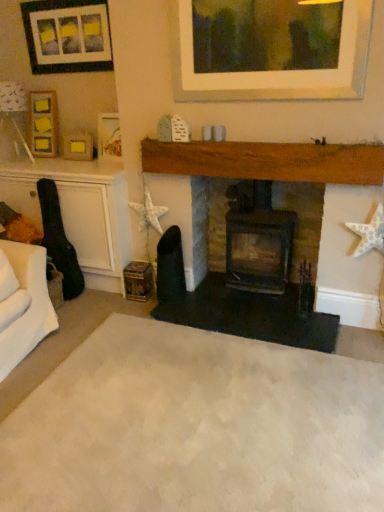
The image size is (384, 512). What do you see at coordinates (267, 161) in the screenshot?
I see `matte black fireplace at center, the 2th fireplace when ordered from right to left` at bounding box center [267, 161].

Measure the distance between point (207,407) and camera.

Point (207,407) is 7.03 feet away from camera.

Locate an element on the screen. black matte fireplace at center, the second fireplace positioned from the left is located at coordinates (302, 220).

Measure the distance between black matte fireplace at center, the second fireplace positioned from the left, and camera.

black matte fireplace at center, the second fireplace positioned from the left, and camera are 9.52 feet apart.

The image size is (384, 512). What do you see at coordinates (109, 136) in the screenshot?
I see `matte wooden picture frame at upper left, arranged as the 2th picture frame when ordered from the bottom` at bounding box center [109, 136].

Where is `matte black picture frame at upper left, acting as the 4th picture frame starting from the bottom`? matte black picture frame at upper left, acting as the 4th picture frame starting from the bottom is located at coordinates pos(67,36).

In order to face matte black picture frame at upper left, acting as the 4th picture frame starting from the bottom, should I rotate leftwards or rightwards?

Turn left approximately 16.334 degrees to face it.

You are a GUI agent. You are given a task and a screenshot of the screen. Output one action in this format:
    pyautogui.click(x=<x>, y=<y>)
    Task: Click on the matte black fireplace at center, placed as the first fireplace when sorted from left to right
    This screenshot has height=512, width=384.
    Given the screenshot: What is the action you would take?
    pyautogui.click(x=267, y=161)

From the image's perspective, would you say matte gold picture frame at upper left, which appears as the first picture frame when ordered from the bottom, is positioned over matte wooden picture frame at upper left, arranged as the 2th picture frame when ordered from the bottom?

Actually, matte gold picture frame at upper left, which appears as the first picture frame when ordered from the bottom, appears below matte wooden picture frame at upper left, arranged as the 2th picture frame when ordered from the bottom, in the image.

Relative to matte wooden picture frame at upper left, arranged as the 2th picture frame when ordered from the bottom, is matte gold picture frame at upper left, placed as the 4th picture frame when sorted from top to bottom, in front or behind?

Clearly, matte gold picture frame at upper left, placed as the 4th picture frame when sorted from top to bottom, is behind matte wooden picture frame at upper left, arranged as the 2th picture frame when ordered from the bottom.

Where is `picture frame below the matte wooden picture frame at upper left, arranged as the 2th picture frame when ordered from the bottom (from a real-world perspective)`? picture frame below the matte wooden picture frame at upper left, arranged as the 2th picture frame when ordered from the bottom (from a real-world perspective) is located at coordinates (78, 146).

Is wooden picture frame at upper left, the third picture frame positioned from the bottom, to the left or to the right of matte wooden picture frame at upper left, the third picture frame viewed from the top, in the image?

wooden picture frame at upper left, the third picture frame positioned from the bottom, is positioned on matte wooden picture frame at upper left, the third picture frame viewed from the top,'s left side.

Does wooden picture frame at upper left, arranged as the 2th picture frame when viewed from the top, have a greater height compared to matte wooden picture frame at upper left, the third picture frame viewed from the top?

Yes.

Considering the relative sizes of wooden picture frame at upper left, arranged as the 2th picture frame when viewed from the top, and matte wooden picture frame at upper left, arranged as the 2th picture frame when ordered from the bottom, in the image provided, is wooden picture frame at upper left, arranged as the 2th picture frame when viewed from the top, thinner than matte wooden picture frame at upper left, arranged as the 2th picture frame when ordered from the bottom,?

No.

Based on the photo, from the image's perspective, which one is positioned higher, matte black picture frame at upper left, acting as the first picture frame starting from the top, or matte black fireplace at center, the 2th fireplace when ordered from right to left?

matte black picture frame at upper left, acting as the first picture frame starting from the top.

Is matte black picture frame at upper left, acting as the first picture frame starting from the top, situated inside matte black fireplace at center, the 2th fireplace when ordered from right to left, or outside?

The correct answer is: outside.

Could you measure the distance between matte black picture frame at upper left, acting as the 4th picture frame starting from the bottom, and matte black fireplace at center, the 2th fireplace when ordered from right to left?

matte black picture frame at upper left, acting as the 4th picture frame starting from the bottom, is 1.24 meters away from matte black fireplace at center, the 2th fireplace when ordered from right to left.

Which is behind, matte black picture frame at upper left, acting as the first picture frame starting from the top, or matte black fireplace at center, placed as the first fireplace when sorted from left to right?

matte black picture frame at upper left, acting as the first picture frame starting from the top, is more distant.

Considering the sizes of objects black matte fireplace at center, the second fireplace positioned from the left, and beige carpet at center in the image provided, who is thinner, black matte fireplace at center, the second fireplace positioned from the left, or beige carpet at center?

black matte fireplace at center, the second fireplace positioned from the left.

Who is smaller, black matte fireplace at center, the first fireplace viewed from the right, or beige carpet at center?

beige carpet at center is smaller.

Looking at this image, does black matte fireplace at center, the first fireplace viewed from the right, touch beige carpet at center?

There is a gap between black matte fireplace at center, the first fireplace viewed from the right, and beige carpet at center.

Can you confirm if matte wooden picture frame at upper left, arranged as the 2th picture frame when ordered from the bottom, is positioned to the right of matte gold picture frame at upper left, which appears as the first picture frame when ordered from the bottom?

Correct, you'll find matte wooden picture frame at upper left, arranged as the 2th picture frame when ordered from the bottom, to the right of matte gold picture frame at upper left, which appears as the first picture frame when ordered from the bottom.

Between matte wooden picture frame at upper left, arranged as the 2th picture frame when ordered from the bottom, and matte gold picture frame at upper left, placed as the 4th picture frame when sorted from top to bottom, which one has smaller size?

matte gold picture frame at upper left, placed as the 4th picture frame when sorted from top to bottom.

Is matte wooden picture frame at upper left, arranged as the 2th picture frame when ordered from the bottom, next to matte gold picture frame at upper left, which appears as the first picture frame when ordered from the bottom, and touching it?

No, matte wooden picture frame at upper left, arranged as the 2th picture frame when ordered from the bottom, is not next to matte gold picture frame at upper left, which appears as the first picture frame when ordered from the bottom.

From the image's perspective, would you say wooden picture frame at upper left, arranged as the 2th picture frame when viewed from the top, is positioned over matte gold picture frame at upper left, which appears as the first picture frame when ordered from the bottom?

Correct, wooden picture frame at upper left, arranged as the 2th picture frame when viewed from the top, appears higher than matte gold picture frame at upper left, which appears as the first picture frame when ordered from the bottom, in the image.

Is wooden picture frame at upper left, the third picture frame positioned from the bottom, positioned behind matte gold picture frame at upper left, which appears as the first picture frame when ordered from the bottom?

Yes, wooden picture frame at upper left, the third picture frame positioned from the bottom, is further from the viewer.

In the scene shown: Which of these two, wooden picture frame at upper left, arranged as the 2th picture frame when viewed from the top, or matte gold picture frame at upper left, which appears as the first picture frame when ordered from the bottom, stands shorter?

matte gold picture frame at upper left, which appears as the first picture frame when ordered from the bottom.

How different are the orientations of matte gold picture frame at upper left, placed as the 4th picture frame when sorted from top to bottom, and wooden picture frame at upper left, the third picture frame positioned from the bottom, in degrees?

matte gold picture frame at upper left, placed as the 4th picture frame when sorted from top to bottom, and wooden picture frame at upper left, the third picture frame positioned from the bottom, are facing 1.95 degrees away from each other.

Is matte gold picture frame at upper left, placed as the 4th picture frame when sorted from top to bottom, to the left or to the right of wooden picture frame at upper left, arranged as the 2th picture frame when viewed from the top, in the image?

In the image, matte gold picture frame at upper left, placed as the 4th picture frame when sorted from top to bottom, appears on the right side of wooden picture frame at upper left, arranged as the 2th picture frame when viewed from the top.

From the picture: Is matte gold picture frame at upper left, which appears as the first picture frame when ordered from the bottom, facing away from wooden picture frame at upper left, the third picture frame positioned from the bottom?

No, matte gold picture frame at upper left, which appears as the first picture frame when ordered from the bottom,'s orientation is not away from wooden picture frame at upper left, the third picture frame positioned from the bottom.

Does point (90, 137) appear closer or farther from the camera than point (34, 118)?

Point (90, 137) is closer to the camera than point (34, 118).

Locate an element on the screen. This screenshot has width=384, height=512. the 1st picture frame directly above the matte gold picture frame at upper left, placed as the 4th picture frame when sorted from top to bottom (from a real-world perspective) is located at coordinates (109, 136).

Image resolution: width=384 pixels, height=512 pixels. Find the location of `picture frame that is the 3rd object to the left of the matte wooden picture frame at upper left, the third picture frame viewed from the top, starting at the anchor`. picture frame that is the 3rd object to the left of the matte wooden picture frame at upper left, the third picture frame viewed from the top, starting at the anchor is located at coordinates (43, 123).

Based on their spatial positions, is beige carpet at center or matte wooden picture frame at upper left, the third picture frame viewed from the top, further from matte black fireplace at center, placed as the first fireplace when sorted from left to right?

beige carpet at center is positioned further to the anchor matte black fireplace at center, placed as the first fireplace when sorted from left to right.

When comparing their distances from matte wooden picture frame at upper left, the third picture frame viewed from the top, does matte gold picture frame at upper left, which appears as the first picture frame when ordered from the bottom, or matte black fireplace at center, placed as the first fireplace when sorted from left to right, seem closer?

matte gold picture frame at upper left, which appears as the first picture frame when ordered from the bottom, lies closer to matte wooden picture frame at upper left, the third picture frame viewed from the top, than the other object.

Looking at the image, which one is located further to matte wooden picture frame at upper left, the third picture frame viewed from the top, black matte fireplace at center, the first fireplace viewed from the right, or wooden picture frame at upper left, the third picture frame positioned from the bottom?

Among the two, black matte fireplace at center, the first fireplace viewed from the right, is located further to matte wooden picture frame at upper left, the third picture frame viewed from the top.

From the image, which object appears to be nearer to matte gold picture frame at upper left, placed as the 4th picture frame when sorted from top to bottom, matte black picture frame at upper left, acting as the first picture frame starting from the top, or wooden picture frame at upper left, the third picture frame positioned from the bottom?

Based on the image, wooden picture frame at upper left, the third picture frame positioned from the bottom, appears to be nearer to matte gold picture frame at upper left, placed as the 4th picture frame when sorted from top to bottom.

Looking at the image, which one is located closer to matte black fireplace at center, placed as the first fireplace when sorted from left to right, wooden picture frame at upper left, the third picture frame positioned from the bottom, or black matte fireplace at center, the second fireplace positioned from the left?

The object closer to matte black fireplace at center, placed as the first fireplace when sorted from left to right, is black matte fireplace at center, the second fireplace positioned from the left.

Based on their spatial positions, is matte black fireplace at center, placed as the first fireplace when sorted from left to right, or matte gold picture frame at upper left, placed as the 4th picture frame when sorted from top to bottom, further from beige carpet at center?

matte gold picture frame at upper left, placed as the 4th picture frame when sorted from top to bottom, lies further to beige carpet at center than the other object.

When comparing their distances from matte wooden picture frame at upper left, the third picture frame viewed from the top, does black matte fireplace at center, the second fireplace positioned from the left, or matte black fireplace at center, placed as the first fireplace when sorted from left to right, seem further?

Among the two, black matte fireplace at center, the second fireplace positioned from the left, is located further to matte wooden picture frame at upper left, the third picture frame viewed from the top.

Based on their spatial positions, is beige carpet at center or matte gold picture frame at upper left, placed as the 4th picture frame when sorted from top to bottom, further from wooden picture frame at upper left, the third picture frame positioned from the bottom?

Based on the image, beige carpet at center appears to be further to wooden picture frame at upper left, the third picture frame positioned from the bottom.

Locate an element on the screen. picture frame between matte gold picture frame at upper left, placed as the 4th picture frame when sorted from top to bottom, and black matte fireplace at center, the second fireplace positioned from the left, in the horizontal direction is located at coordinates (109, 136).

Locate an element on the screen. The image size is (384, 512). fireplace between matte gold picture frame at upper left, which appears as the first picture frame when ordered from the bottom, and black matte fireplace at center, the first fireplace viewed from the right is located at coordinates (267, 161).

Locate an element on the screen. fireplace situated between matte wooden picture frame at upper left, arranged as the 2th picture frame when ordered from the bottom, and black matte fireplace at center, the second fireplace positioned from the left, from left to right is located at coordinates (267, 161).

Find the location of a particular element. The height and width of the screenshot is (512, 384). picture frame between matte gold picture frame at upper left, which appears as the first picture frame when ordered from the bottom, and matte black fireplace at center, the 2th fireplace when ordered from right to left, in the horizontal direction is located at coordinates point(109,136).